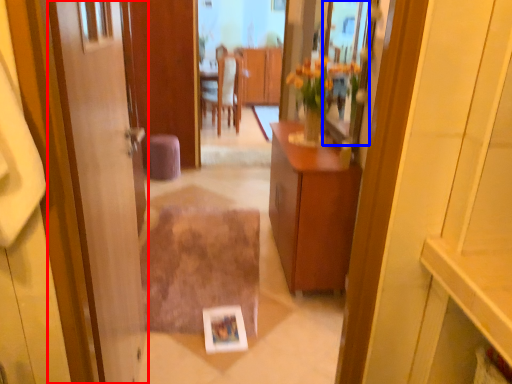
Question: Which point is closer to the camera, door (highlighted by a red box) or mirror (highlighted by a blue box)?

Choices:
 (A) door
 (B) mirror

Answer: (A)